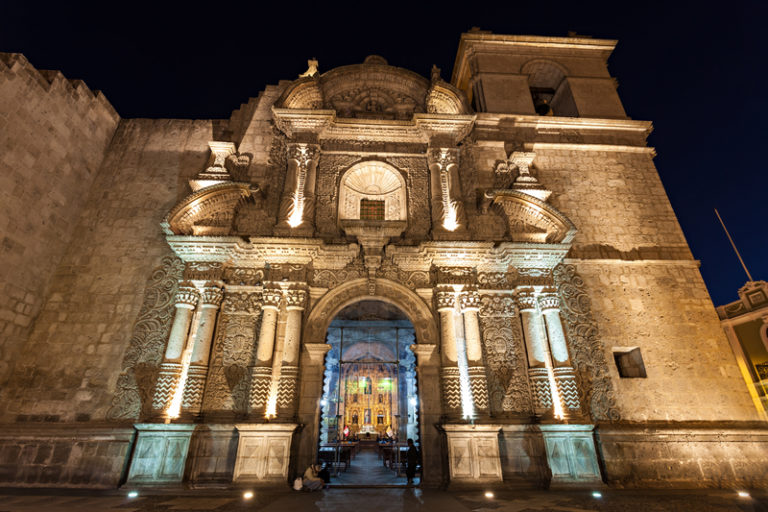
This screenshot has width=768, height=512. Identify the location of light blue glowing vertical lines at entryway. (326, 378), (411, 382).